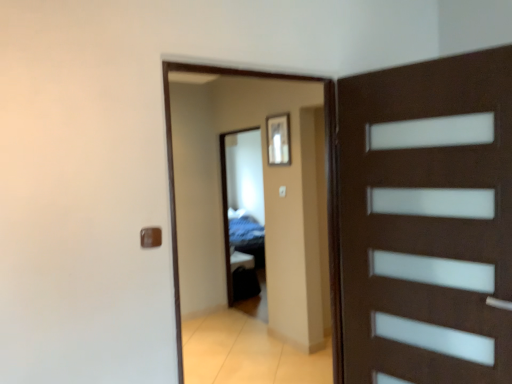
Where is `transparent glass door at center`? This screenshot has width=512, height=384. transparent glass door at center is located at coordinates (327, 193).

What is the approximate width of brown matte door handle at lower left?

The width of brown matte door handle at lower left is 2.74 centimeters.

Image resolution: width=512 pixels, height=384 pixels. I want to click on transparent glass door at center, so click(x=327, y=193).

Is transparent glass mirror at center closer to the viewer compared to transparent glass door at center?

That is False.

Does transparent glass mirror at center touch transparent glass door at center?

They are not placed beside each other.

You are a GUI agent. You are given a task and a screenshot of the screen. Output one action in this format:
    pyautogui.click(x=<x>, y=<y>)
    Task: Click on the mirror below the transparent glass door at center (from a real-world perspective)
    
    Given the screenshot: What is the action you would take?
    pyautogui.click(x=243, y=208)

Are brown matte door handle at lower left and transparent glass door at center making contact?

No.

From the image's perspective, is brown matte door handle at lower left on top of transparent glass door at center?

Correct, brown matte door handle at lower left appears higher than transparent glass door at center in the image.

How different are the orientations of brown matte door handle at lower left and transparent glass door at center in degrees?

The facing directions of brown matte door handle at lower left and transparent glass door at center are 0.129 degrees apart.

At what (x,y) coordinates should I click in order to perform the action: click on door handle lying in front of the transparent glass door at center. Please return your answer as a coordinate pair (x, y). Looking at the image, I should click on (150, 237).

Which is in front, transparent glass door at center or brown matte door handle at lower left?

brown matte door handle at lower left is closer to the camera.

From the image's perspective, who appears lower, transparent glass door at center or brown matte door handle at lower left?

transparent glass door at center is shown below in the image.

Between transparent glass door at center and brown matte door handle at lower left, which one appears on the right side from the viewer's perspective?

Positioned to the right is transparent glass door at center.

Are transparent glass door at center and brown matte door handle at lower left far apart?

No, there isn't a large distance between transparent glass door at center and brown matte door handle at lower left.

In the scene shown: What's the angular difference between brown matte door handle at lower left and transparent glass mirror at center's facing directions?

88.6 degrees separate the facing orientations of brown matte door handle at lower left and transparent glass mirror at center.

Could you tell me if brown matte door handle at lower left is facing transparent glass mirror at center?

No, brown matte door handle at lower left is not oriented towards transparent glass mirror at center.

Is brown matte door handle at lower left wider or thinner than transparent glass mirror at center?

In the image, brown matte door handle at lower left appears to be more narrow than transparent glass mirror at center.

Is brown matte door handle at lower left behind transparent glass mirror at center?

That is False.

Looking at this image, can you confirm if transparent glass mirror at center is taller than brown matte door handle at lower left?

Yes, transparent glass mirror at center is taller than brown matte door handle at lower left.

From the image's perspective, is transparent glass mirror at center under brown matte door handle at lower left?

Yes, from the image's perspective, transparent glass mirror at center is beneath brown matte door handle at lower left.

In the image, is transparent glass mirror at center positioned in front of or behind brown matte door handle at lower left?

Clearly, transparent glass mirror at center is behind brown matte door handle at lower left.

Is transparent glass mirror at center not close to brown matte door handle at lower left?

transparent glass mirror at center is positioned a significant distance from brown matte door handle at lower left.

Would you say transparent glass door at center is inside or outside transparent glass mirror at center?

transparent glass door at center cannot be found inside transparent glass mirror at center.

What's the angular difference between transparent glass door at center and transparent glass mirror at center's facing directions?

88.5 degrees separate the facing orientations of transparent glass door at center and transparent glass mirror at center.

Is transparent glass door at center oriented away from transparent glass mirror at center?

No, transparent glass mirror at center is not at the back of transparent glass door at center.

Would you consider transparent glass door at center to be distant from transparent glass mirror at center?

Yes, transparent glass door at center and transparent glass mirror at center are quite far apart.

The height and width of the screenshot is (384, 512). I want to click on screen door above the transparent glass mirror at center (from the image's perspective), so click(x=327, y=193).

Where is `screen door on the right of brown matte door handle at lower left`? The image size is (512, 384). screen door on the right of brown matte door handle at lower left is located at coordinates (327, 193).

From the image, which object appears to be farther from brown matte door handle at lower left, transparent glass door at center or transparent glass mirror at center?

Among the two, transparent glass mirror at center is located further to brown matte door handle at lower left.

Which object lies further to the anchor point transparent glass door at center, brown matte door handle at lower left or transparent glass mirror at center?

transparent glass mirror at center lies further to transparent glass door at center than the other object.

Looking at the image, which one is located further to transparent glass door at center, transparent glass mirror at center or brown matte door handle at lower left?

transparent glass mirror at center.

In the scene shown: Looking at the image, which one is located closer to transparent glass mirror at center, transparent glass door at center or brown matte door handle at lower left?

transparent glass door at center is positioned closer to the anchor transparent glass mirror at center.

Based on their spatial positions, is brown matte door handle at lower left or transparent glass door at center further from transparent glass mirror at center?

Based on the image, brown matte door handle at lower left appears to be further to transparent glass mirror at center.

Considering their positions, is transparent glass mirror at center positioned further to brown matte door handle at lower left than transparent glass door at center?

The object further to brown matte door handle at lower left is transparent glass mirror at center.

Find the location of a particular element. screen door between brown matte door handle at lower left and transparent glass mirror at center along the z-axis is located at coordinates (327, 193).